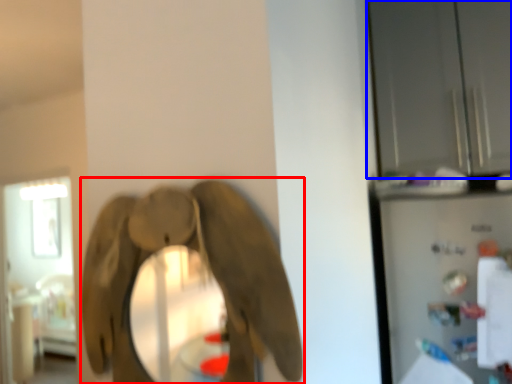
Question: Which object is closer to the camera taking this photo, elephant (highlighted by a red box) or glass door (highlighted by a blue box)?

Choices:
 (A) elephant
 (B) glass door

Answer: (A)